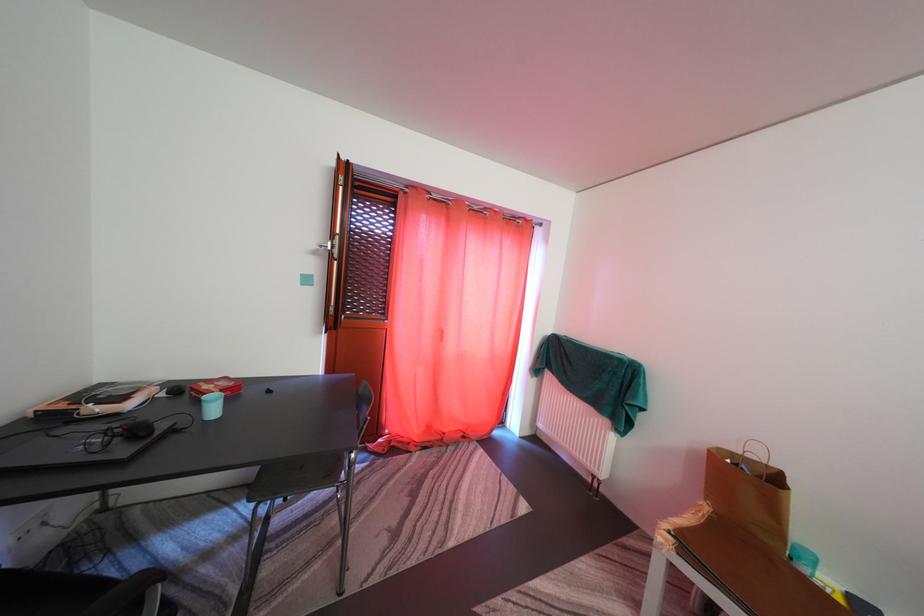
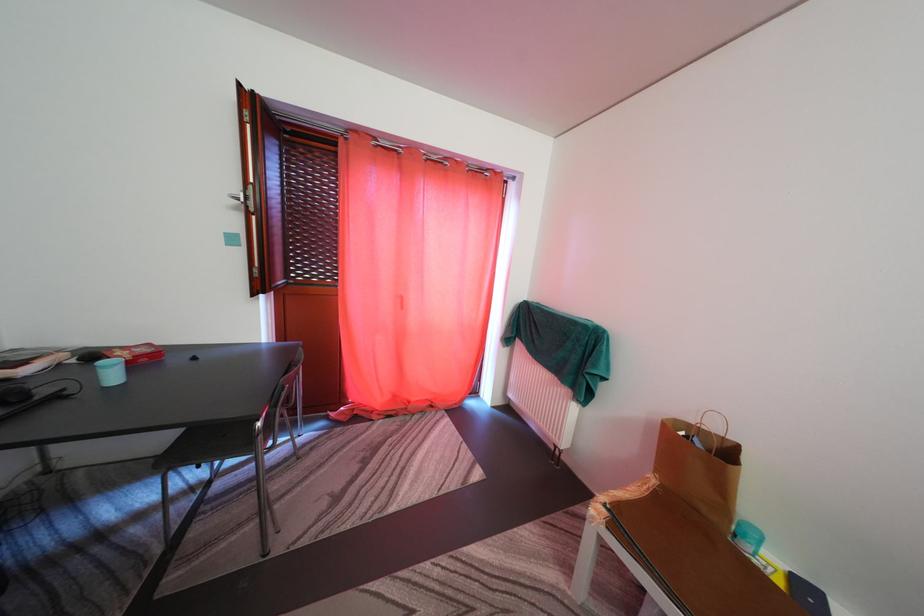
Locate, in the second image, the point that corresponds to point 723,532 in the first image.

(666, 505)